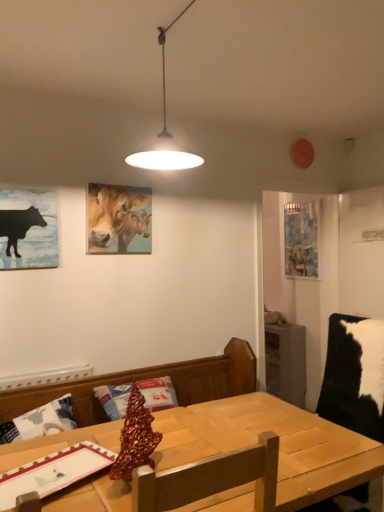
Question: From a real-world perspective, is wooden table at center below black paper at left, which ranks as the third picture frame in right-to-left order?

Choices:
 (A) no
 (B) yes

Answer: (B)

Question: Is wooden table at center smaller than black paper at left, the third picture frame positioned from the back?

Choices:
 (A) yes
 (B) no

Answer: (B)

Question: Can you confirm if wooden table at center is bigger than black paper at left, the third picture frame positioned from the back?

Choices:
 (A) no
 (B) yes

Answer: (B)

Question: Is wooden table at center not near black paper at left, the first picture frame positioned from the left?

Choices:
 (A) yes
 (B) no

Answer: (B)

Question: From the image's perspective, is wooden table at center located beneath black paper at left, the 1th picture frame positioned from the front?

Choices:
 (A) no
 (B) yes

Answer: (B)

Question: From their relative heights in the image, would you say wooden table at center is taller or shorter than oil painting of cows at upper center, arranged as the 2th picture frame when viewed from the front?

Choices:
 (A) short
 (B) tall

Answer: (B)

Question: Is wooden table at center situated inside oil painting of cows at upper center, the 2th picture frame viewed from the left, or outside?

Choices:
 (A) inside
 (B) outside

Answer: (B)

Question: From a real-world perspective, is wooden table at center physically located above or below oil painting of cows at upper center, the 2th picture frame viewed from the left?

Choices:
 (A) above
 (B) below

Answer: (B)

Question: Would you say wooden table at center is to the left or to the right of oil painting of cows at upper center, arranged as the 2th picture frame when viewed from the right, in the picture?

Choices:
 (A) left
 (B) right

Answer: (B)

Question: From a real-world perspective, is wooden table at center above or below wooden table at center?

Choices:
 (A) below
 (B) above

Answer: (B)

Question: Considering the positions of wooden table at center and wooden table at center in the image, is wooden table at center bigger or smaller than wooden table at center?

Choices:
 (A) small
 (B) big

Answer: (A)

Question: Relative to wooden table at center, is wooden table at center in front or behind?

Choices:
 (A) behind
 (B) front

Answer: (A)

Question: Choose the correct answer: Is wooden table at center inside wooden table at center or outside it?

Choices:
 (A) inside
 (B) outside

Answer: (B)

Question: From their relative heights in the image, would you say wooden table at center is taller or shorter than wooden table at center?

Choices:
 (A) short
 (B) tall

Answer: (B)

Question: From the image's perspective, relative to wooden table at center, is wooden table at center above or below?

Choices:
 (A) above
 (B) below

Answer: (B)